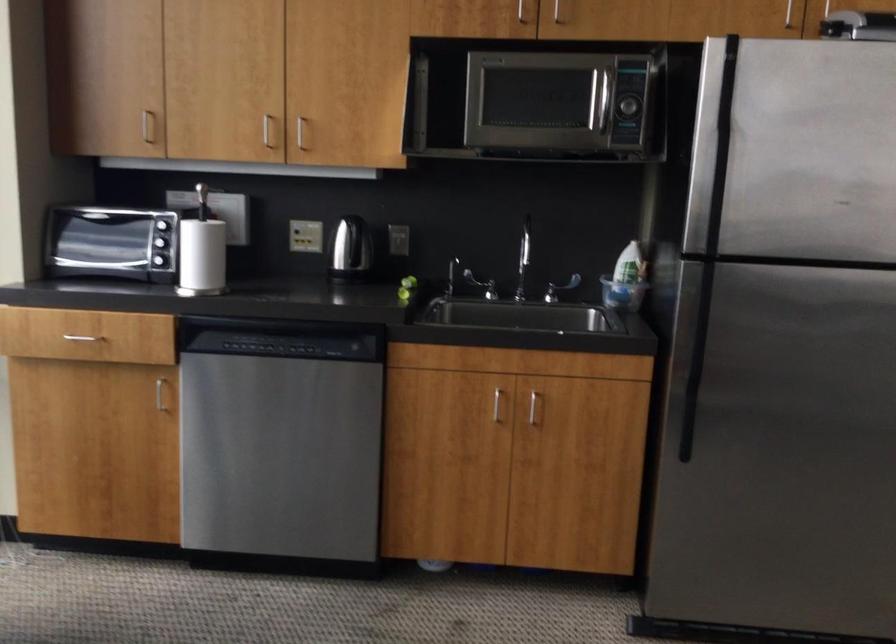
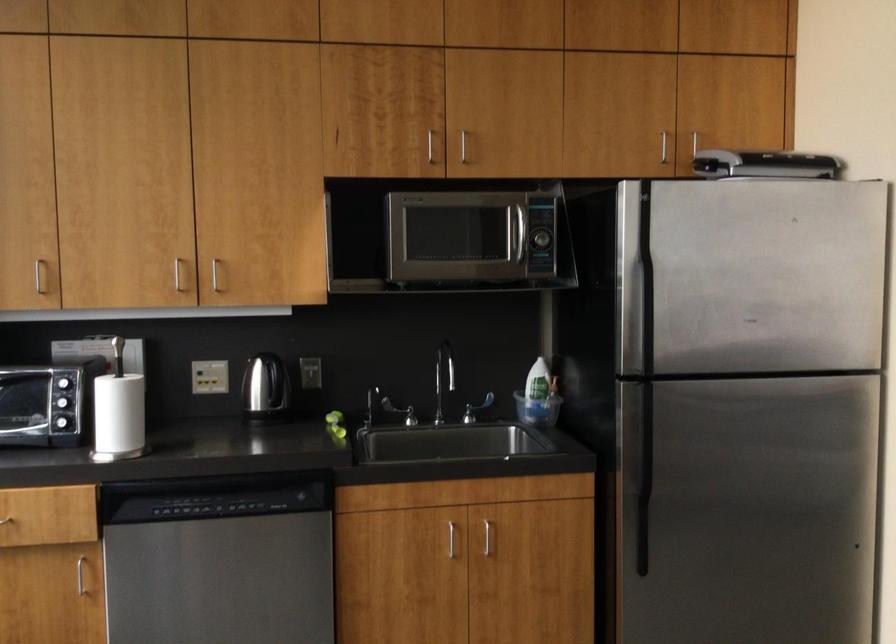
Question: The camera is either moving clockwise (left) or counter-clockwise (right) around the object. The first image is from the beginning of the video and the second image is from the end. Is the camera moving left or right when shooting the video?

Choices:
 (A) Left
 (B) Right

Answer: (A)